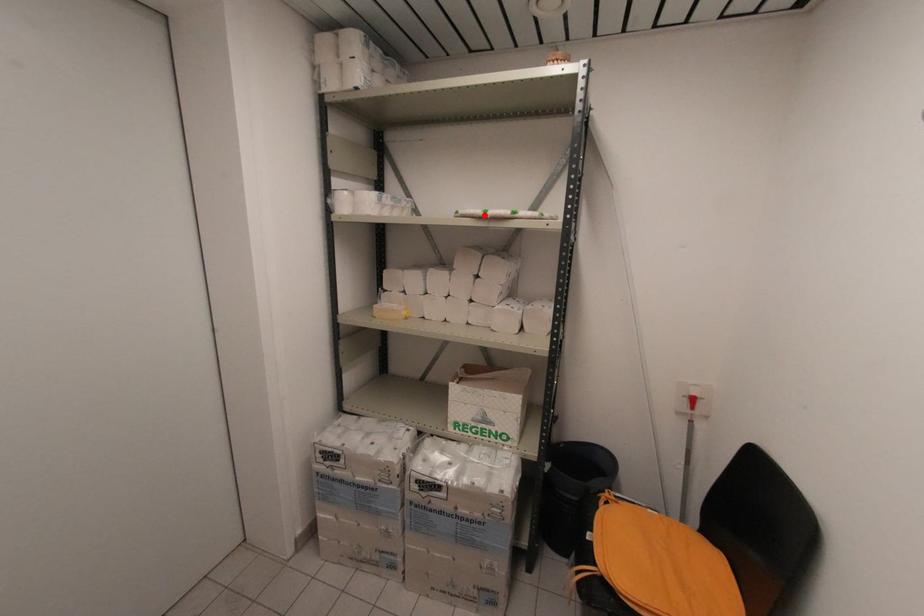
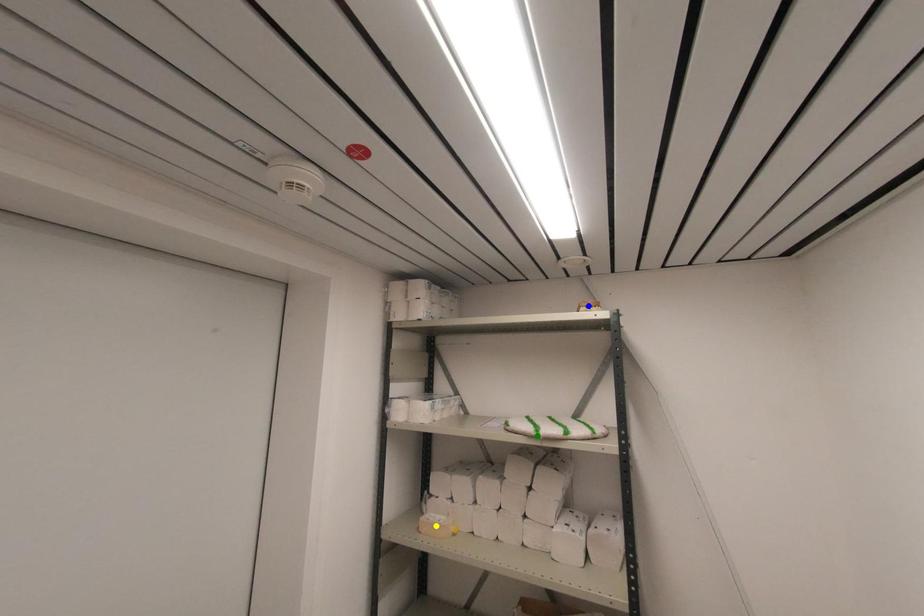
Question: I am providing you with two images of the same scene from different viewpoints. A red point is marked on the first image. You are given multiple points on the second image. Which point in image 2 is actually the same real-world point as the red point in image 1?

Choices:
 (A) yellow point
 (B) blue point
 (C) green point

Answer: (C)